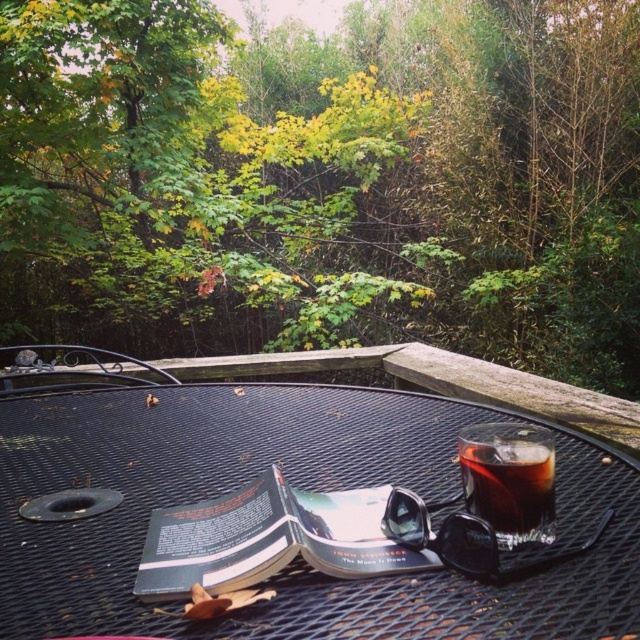
You are a delivery person who needs to place a small package on the black mesh table at center without tipping over the dark glass cup at center. The package is 12 inches wide. Can you safely place it between them?

The black mesh table at center and dark glass cup at center are 15.97 inches apart. Since the package is 12 inches wide, there is enough space to place it between them without tipping over the dark glass cup at center.

You are a person who wants to place a small plant pot on the black mesh table at center. However, you notice the dark glass cup at center is already there. Can you still place the plant pot on the table without knocking over the cup?

The black mesh table at center is not as tall as dark glass cup at center, meaning the cup is taller than the table. Since the cup is already on the table, there might be limited space. However, the question is about placing the plant pot without knocking over the cup. The height difference doesn not directly affect stability unless the cup is too tall, but the main concern is spatial arrangement. The answer should focus on the table being shorter than the cup, but since the cup is on the table, the table s

You are a guest at this outdoor space and want to place a small plate between the black mesh table at center and the dark glass cup at center. Based on their positions, where should you place the plate?

The black mesh table at center is to the left of the dark glass cup at center, so you should place the plate to the right of the black mesh table at center and to the left of the dark glass cup at center.